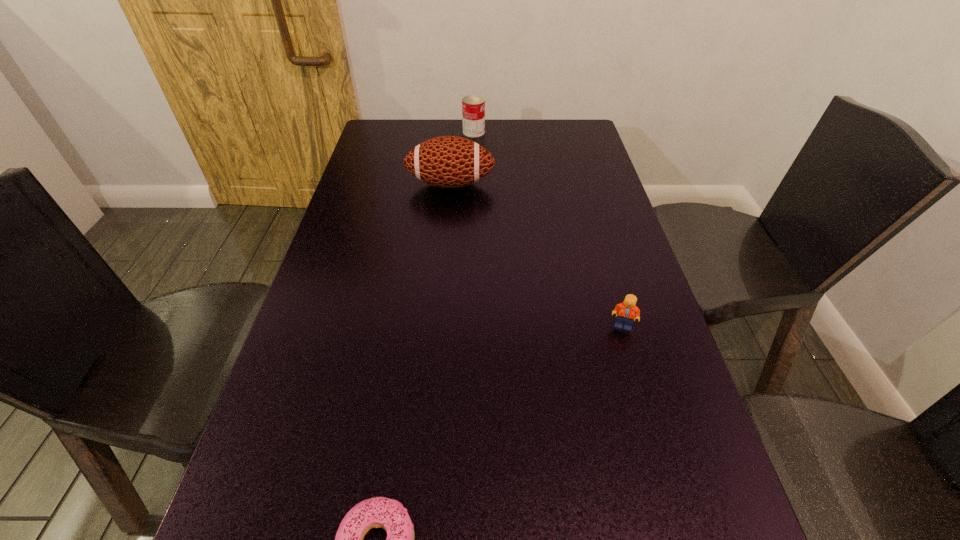
Where is `the third nearest object`? the third nearest object is located at coordinates (446, 161).

Identify the location of football. (446, 161).

The image size is (960, 540). I want to click on the farthest object, so click(473, 106).

Where is `the third shortest object`? Image resolution: width=960 pixels, height=540 pixels. the third shortest object is located at coordinates (473, 106).

What are the coordinates of `the second nearest object` in the screenshot? It's located at tap(625, 312).

You are a GUI agent. You are given a task and a screenshot of the screen. Output one action in this format:
    pyautogui.click(x=<x>, y=<y>)
    Task: Click on the rightmost object
    The image size is (960, 540).
    Given the screenshot: What is the action you would take?
    pyautogui.click(x=625, y=312)

You are a GUI agent. You are given a task and a screenshot of the screen. Output one action in this format:
    pyautogui.click(x=<x>, y=<y>)
    Task: Click on the vacant space situated 0.350m on the back of the football
    
    Given the screenshot: What is the action you would take?
    tap(456, 120)

Where is `vacant space located on the front label of the farthest object`? Image resolution: width=960 pixels, height=540 pixels. vacant space located on the front label of the farthest object is located at coordinates (563, 132).

You are a GUI agent. You are given a task and a screenshot of the screen. Output one action in this format:
    pyautogui.click(x=<x>, y=<y>)
    Task: Click on the free space located on the front-facing side of the third farthest object
    
    Given the screenshot: What is the action you would take?
    pyautogui.click(x=651, y=424)

The width and height of the screenshot is (960, 540). What are the coordinates of `object that is positioned at the far edge` in the screenshot? It's located at (473, 106).